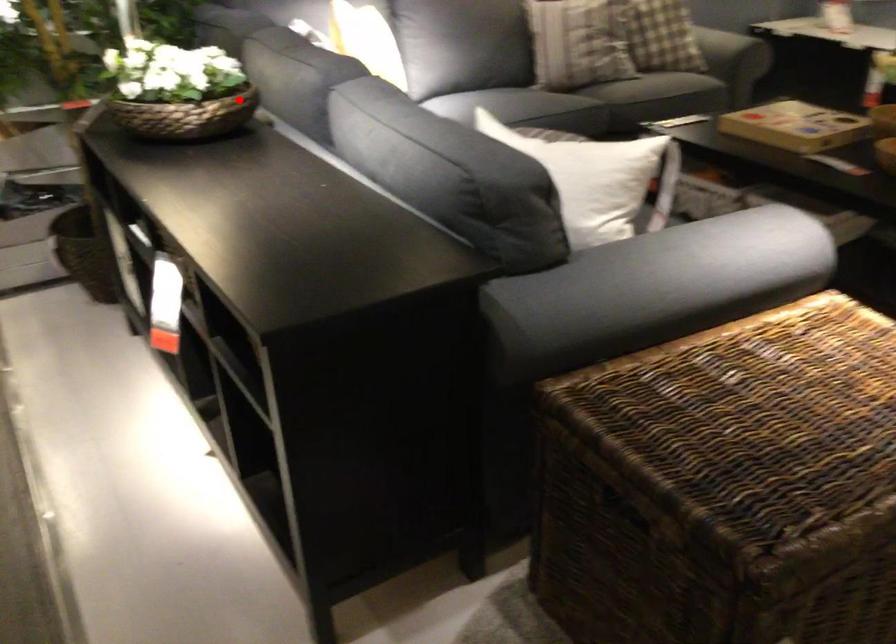
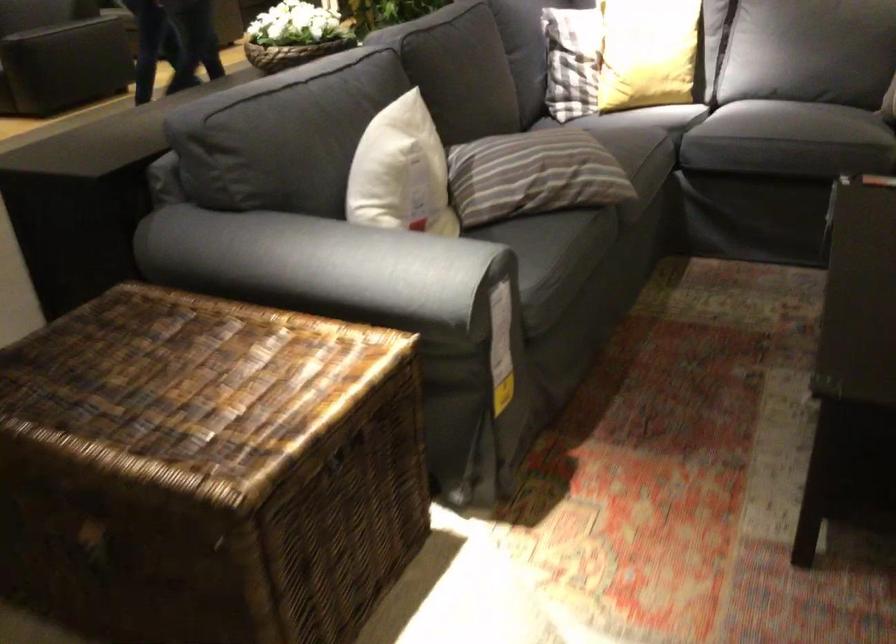
Question: A red point is marked in image1. In image2, is the corresponding 3D point closer to the camera or farther? Reply with the corresponding letter.

Choices:
 (A) The corresponding 3D point is closer.
 (B) The corresponding 3D point is farther.

Answer: (B)